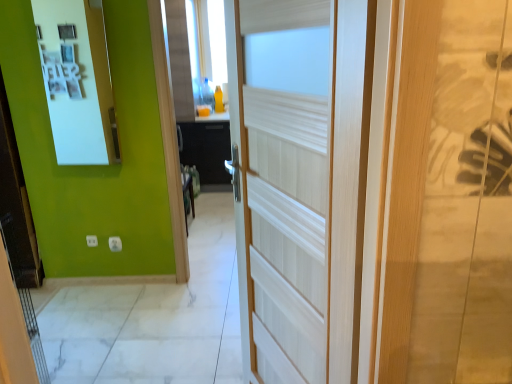
Question: Considering the positions of white wood door at center and white glossy medicine cabinet at upper left in the image, is white wood door at center wider or thinner than white glossy medicine cabinet at upper left?

Choices:
 (A) thin
 (B) wide

Answer: (B)

Question: Considering their positions, is white wood door at center located in front of or behind white glossy medicine cabinet at upper left?

Choices:
 (A) behind
 (B) front

Answer: (B)

Question: Is point (506, 208) positioned closer to the camera than point (81, 152)?

Choices:
 (A) farther
 (B) closer

Answer: (B)

Question: From the image's perspective, relative to white wood door at center, is white glossy medicine cabinet at upper left above or below?

Choices:
 (A) above
 (B) below

Answer: (A)

Question: From their relative heights in the image, would you say white glossy medicine cabinet at upper left is taller or shorter than white wood door at center?

Choices:
 (A) short
 (B) tall

Answer: (A)

Question: Does point [x=91, y=105] appear closer or farther from the camera than point [x=290, y=21]?

Choices:
 (A) farther
 (B) closer

Answer: (A)

Question: From a real-world perspective, relative to white wood door at center, is white glossy medicine cabinet at upper left vertically above or below?

Choices:
 (A) below
 (B) above

Answer: (B)